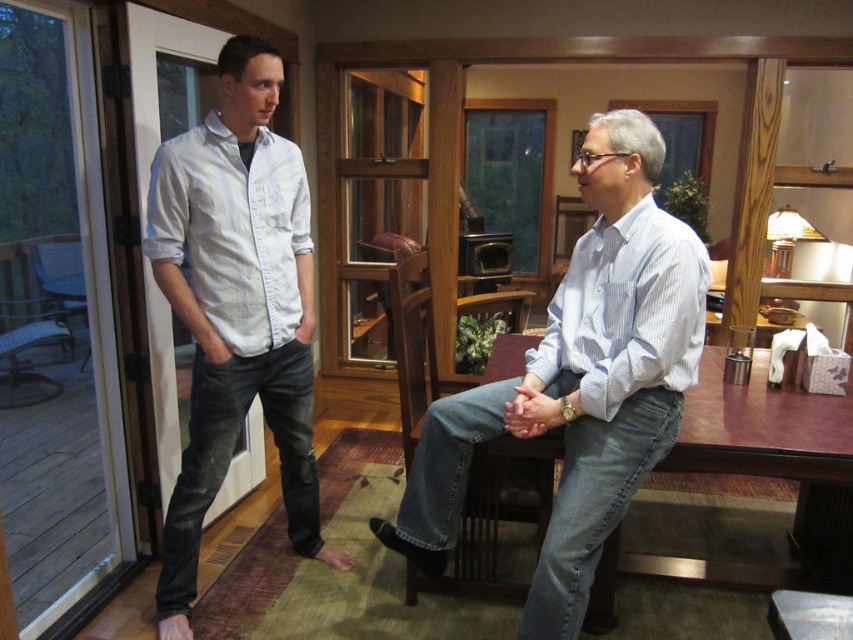
Where is the light blue striped shirt at center located in the image?

The light blue striped shirt at center is located at point 0.597 on the horizontal axis and 0.680 on the vertical axis.

You are a tailor who needs to adjust the length of both the light blue striped shirt at center and the light blue denim jeans at left. Which garment requires more lengthening to reach the same length as the other?

The light blue striped shirt at center is shorter than the light blue denim jeans at left, so the light blue striped shirt at center requires more lengthening to match the length of the light blue denim jeans at left.

You are a fashion designer observing two men in the scene. You need to determine which clothing item is wider between the light blue striped shirt at center and the light blue denim jeans at left. Which one is wider?

The light blue striped shirt at center is wider than the light blue denim jeans at left according to the description.